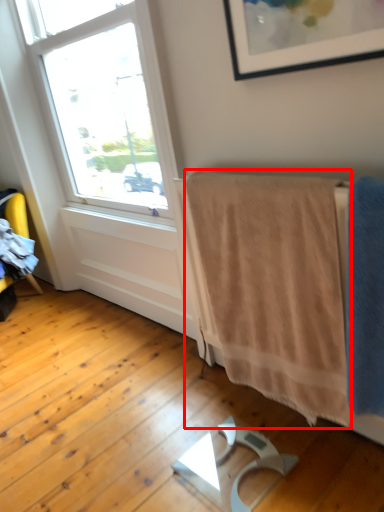
Question: From the image's perspective, what is the correct spatial positioning of bath towel (annotated by the red box) in reference to bath towel?

Choices:
 (A) above
 (B) below

Answer: (A)